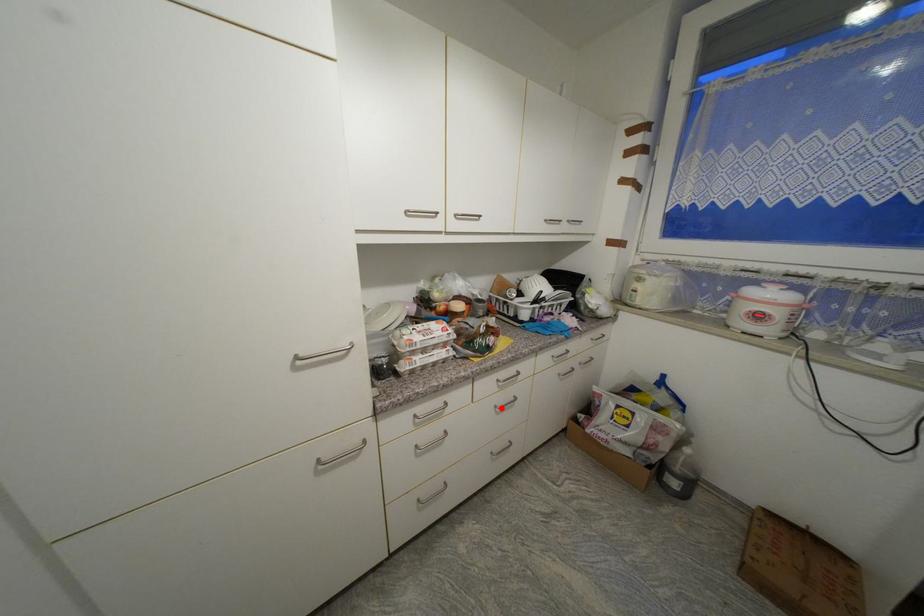
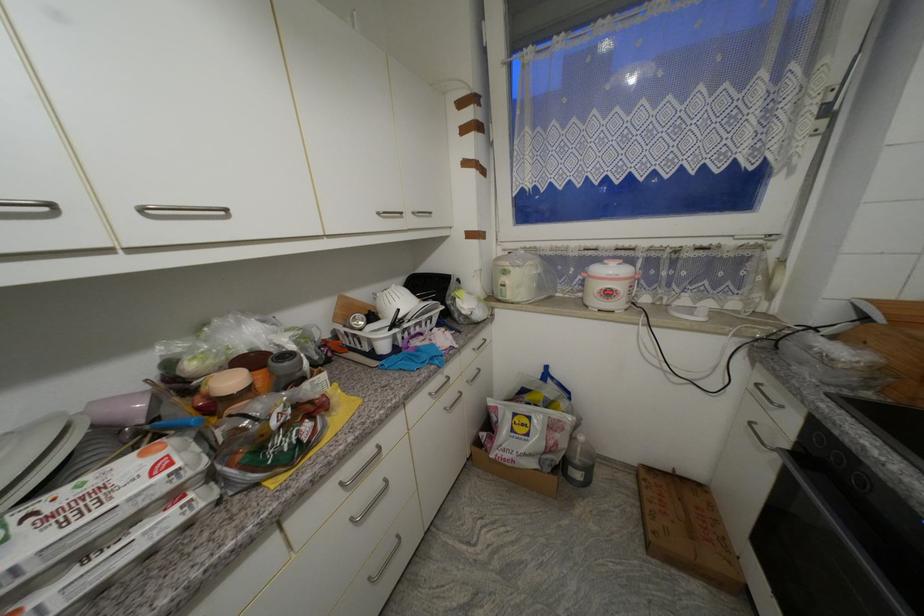
Question: I am providing you with two images of the same scene from different viewpoints. In image1, a red point is highlighted. Considering the same 3D point in image2, which of the following is correct?

Choices:
 (A) It is closer
 (B) It is farther

Answer: (A)